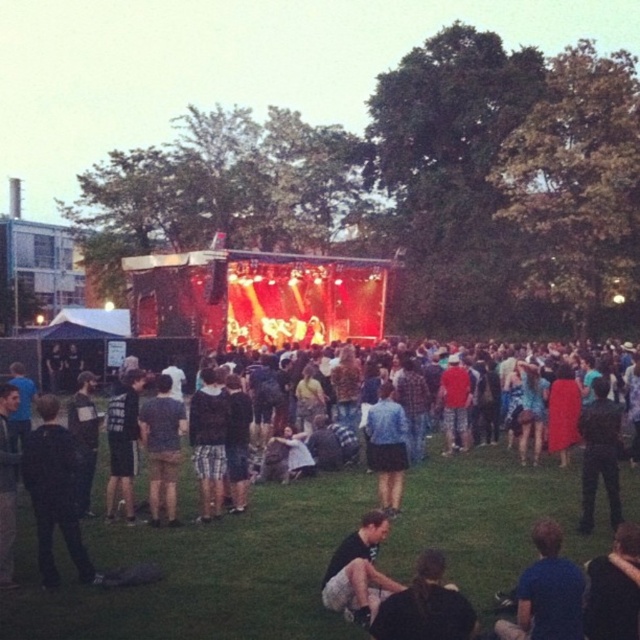
Question: Considering the real-world distances, which object is closest to the dark gray fabric pants at lower center?

Choices:
 (A) dark gray textured shirt at center
 (B) plaid shorts at center
 (C) black matte jacket at left
 (D) blue denim shorts at center

Answer: (C)

Question: Which object is the farthest from the dark blue shirt at lower right?

Choices:
 (A) black fabric jacket at lower center
 (B) blue denim shorts at center
 (C) dark gray fabric pants at lower center

Answer: (B)

Question: Does black fabric jacket at lower center have a smaller size compared to dark gray fabric pants at lower center?

Choices:
 (A) yes
 (B) no

Answer: (B)

Question: Where is blue matte shirt at lower right located in relation to dark gray fabric pants at lower center in the image?

Choices:
 (A) right
 (B) left

Answer: (A)

Question: Based on their relative distances, which object is farther from the blue matte shirt at lower right?

Choices:
 (A) dark blue shirt at lower right
 (B) black fabric jacket at lower center

Answer: (B)

Question: Observing the image, what is the correct spatial positioning of black fabric jacket at lower center in reference to blue denim shorts at center?

Choices:
 (A) left
 (B) right

Answer: (B)